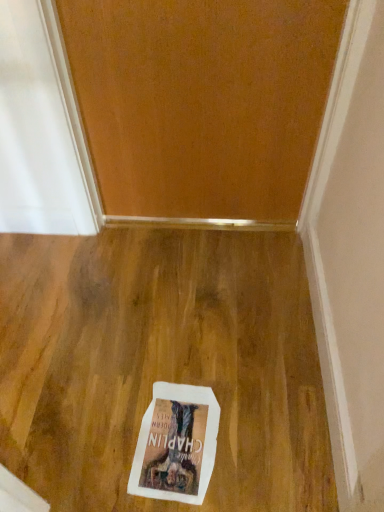
Find the location of a particular element. The width and height of the screenshot is (384, 512). blank space situated above white paper postcard at center (from a real-world perspective) is located at coordinates (167, 428).